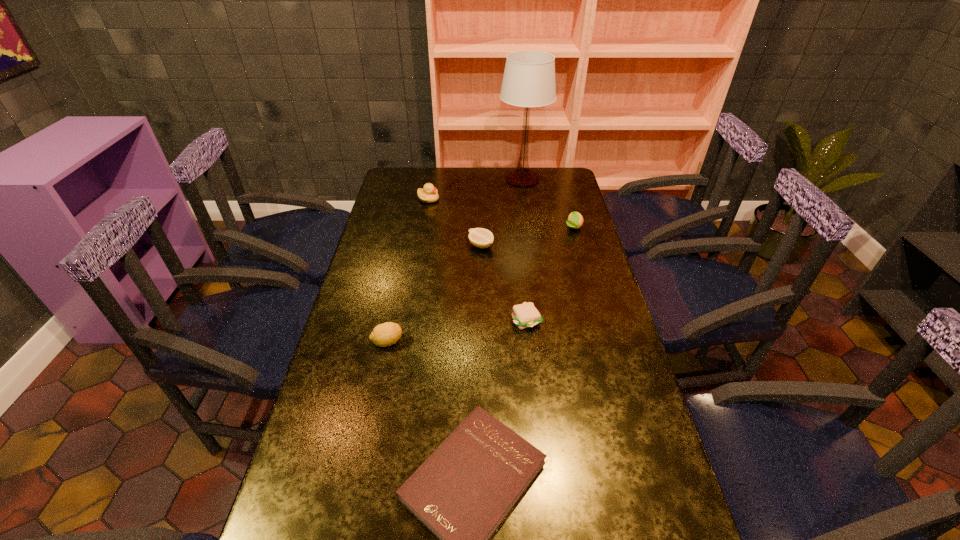
The image size is (960, 540). What are the coordinates of `table lamp located at the right edge` in the screenshot? It's located at (529, 77).

Where is `lemon located at the right edge`? The height and width of the screenshot is (540, 960). lemon located at the right edge is located at coordinates (575, 220).

What are the coordinates of `object located in the far left corner section of the desktop` in the screenshot? It's located at (429, 194).

Find the location of a particular element. The height and width of the screenshot is (540, 960). object that is at the far right corner is located at coordinates (529, 77).

This screenshot has width=960, height=540. Identify the location of free region at the far edge of the desktop. (509, 188).

What are the coordinates of `free space at the left edge of the desktop` in the screenshot? It's located at (363, 491).

You are a GUI agent. You are given a task and a screenshot of the screen. Output one action in this format:
    pyautogui.click(x=<x>, y=<y>)
    Task: Click on the vacant space at the right edge of the desktop
    
    Given the screenshot: What is the action you would take?
    pyautogui.click(x=572, y=336)

Where is `free area in between the tallest object and the duckling`? Image resolution: width=960 pixels, height=540 pixels. free area in between the tallest object and the duckling is located at coordinates (475, 189).

The image size is (960, 540). I want to click on vacant area between the patty and the rightmost lemon, so click(550, 274).

Locate an element on the screen. This screenshot has width=960, height=540. vacant region between the rightmost lemon and the fourth nearest object is located at coordinates (527, 237).